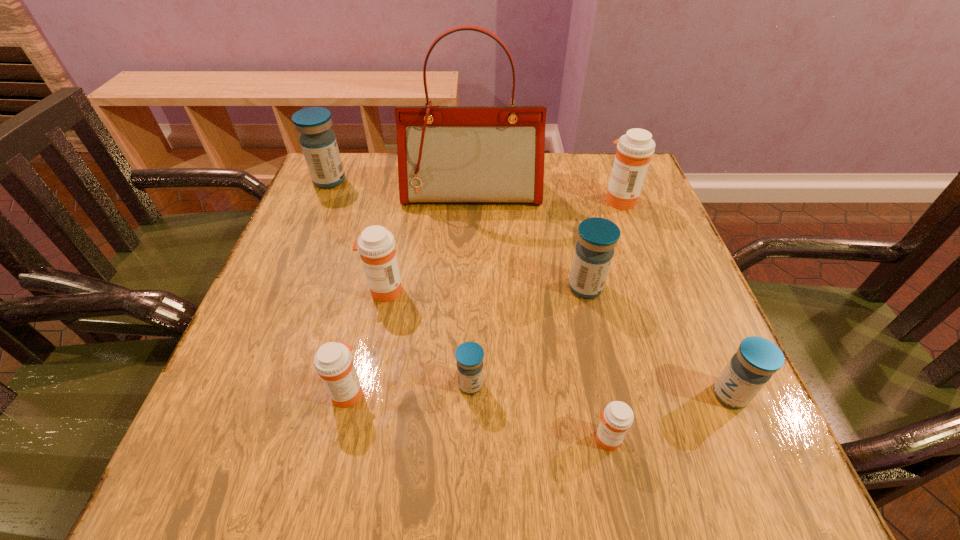
Find the location of a particular element. the tallest object is located at coordinates (446, 154).

The image size is (960, 540). I want to click on handbag, so click(446, 154).

The height and width of the screenshot is (540, 960). Identify the location of the biggest blue medicine. (318, 142).

Identify the location of the farthest blue medicine. This screenshot has height=540, width=960. (318, 142).

Where is `the rightmost orange medicine`? the rightmost orange medicine is located at coordinates (634, 150).

At what (x,y) coordinates should I click in order to perform the action: click on the farthest orange medicine. Please return your answer as a coordinate pair (x, y). The image size is (960, 540). Looking at the image, I should click on (634, 150).

Identify the location of the third nearest orange medicine. (376, 245).

This screenshot has width=960, height=540. Identify the location of the third smallest blue medicine. (597, 237).

Locate an element on the screen. This screenshot has width=960, height=540. the second farthest blue medicine is located at coordinates (597, 237).

Find the location of a particular element. This screenshot has height=540, width=960. the second smallest orange medicine is located at coordinates (333, 362).